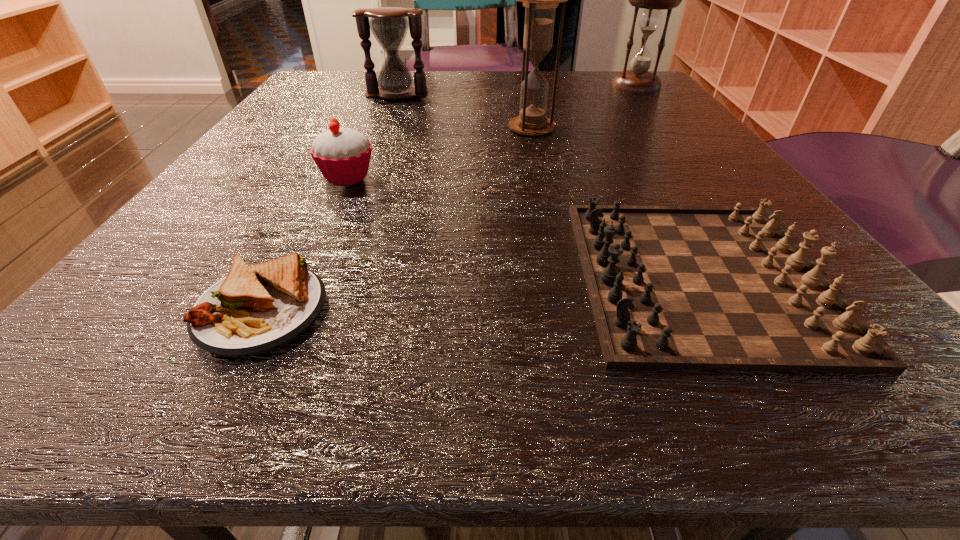
Locate an element on the screen. Image resolution: width=960 pixels, height=540 pixels. vacant space located 0.240m on the front of the leftmost hourglass is located at coordinates (373, 154).

Locate an element on the screen. vacant space located 0.140m on the back of the third shortest object is located at coordinates (371, 129).

At what (x,y) coordinates should I click in order to perform the action: click on free space located 0.210m on the back of the second shortest object. Please return your answer as a coordinate pair (x, y). This screenshot has height=540, width=960. Looking at the image, I should click on (626, 145).

At what (x,y) coordinates should I click in order to perform the action: click on free region located 0.150m on the right of the sandwich. Please return your answer as a coordinate pair (x, y). Looking at the image, I should click on (470, 310).

This screenshot has width=960, height=540. What are the coordinates of `chessboard situated at the near edge` in the screenshot? It's located at (671, 287).

At what (x,y) coordinates should I click in order to perform the action: click on sandwich positioned at the near edge. Please return your answer as a coordinate pair (x, y). Image resolution: width=960 pixels, height=540 pixels. Looking at the image, I should click on (255, 309).

Find the location of a particular element. hourglass situated at the left edge is located at coordinates (389, 25).

The image size is (960, 540). What are the coordinates of `cupcake located at the left edge` in the screenshot? It's located at (342, 155).

In order to click on sandwich positioned at the left edge in this screenshot , I will do `click(255, 309)`.

You are a GUI agent. You are given a task and a screenshot of the screen. Output one action in this format:
    pyautogui.click(x=<x>, y=<y>)
    Task: Click on the hourglass that is positioned at the right edge
    This screenshot has width=960, height=540.
    Given the screenshot: What is the action you would take?
    pyautogui.click(x=637, y=80)